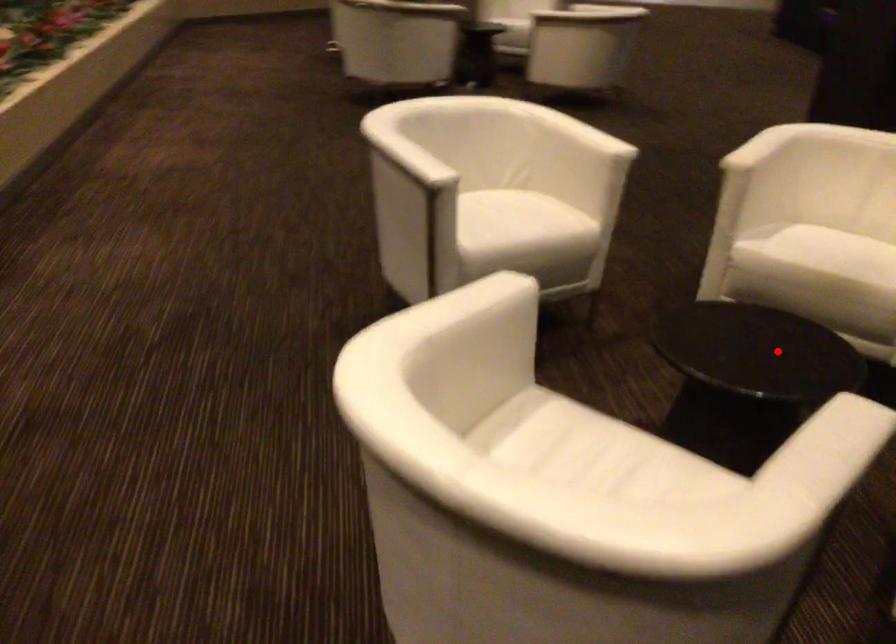
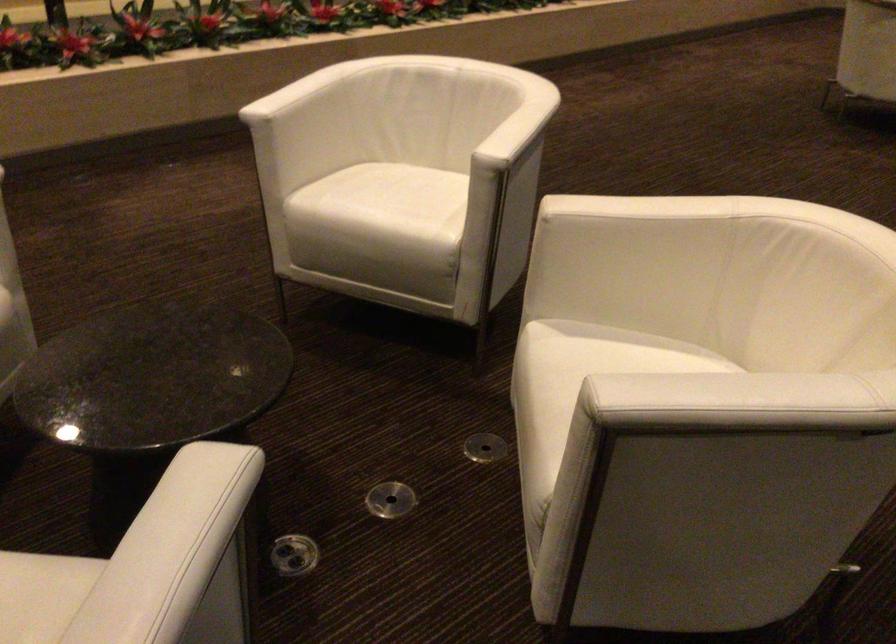
Question: A red point is marked in image1. In image2, is the corresponding 3D point closer to the camera or farther? Reply with the corresponding letter.

Choices:
 (A) The corresponding 3D point is closer.
 (B) The corresponding 3D point is farther.

Answer: (A)